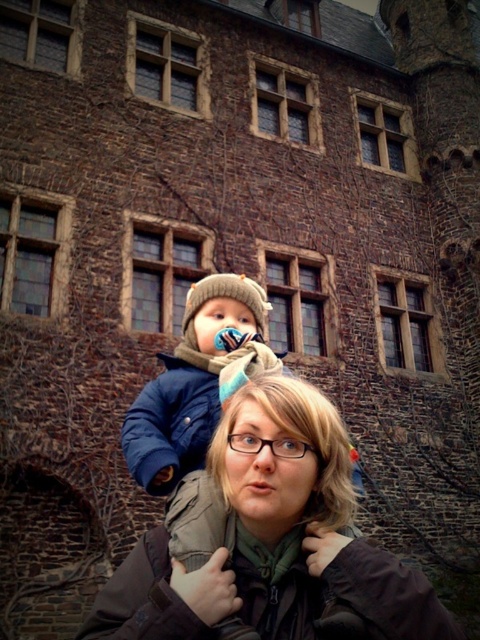
Is green fabric jacket at center above blue fleece jacket at center?

Actually, green fabric jacket at center is below blue fleece jacket at center.

This screenshot has width=480, height=640. In order to click on green fabric jacket at center in this screenshot , I will do `click(274, 540)`.

The height and width of the screenshot is (640, 480). I want to click on green fabric jacket at center, so click(x=274, y=540).